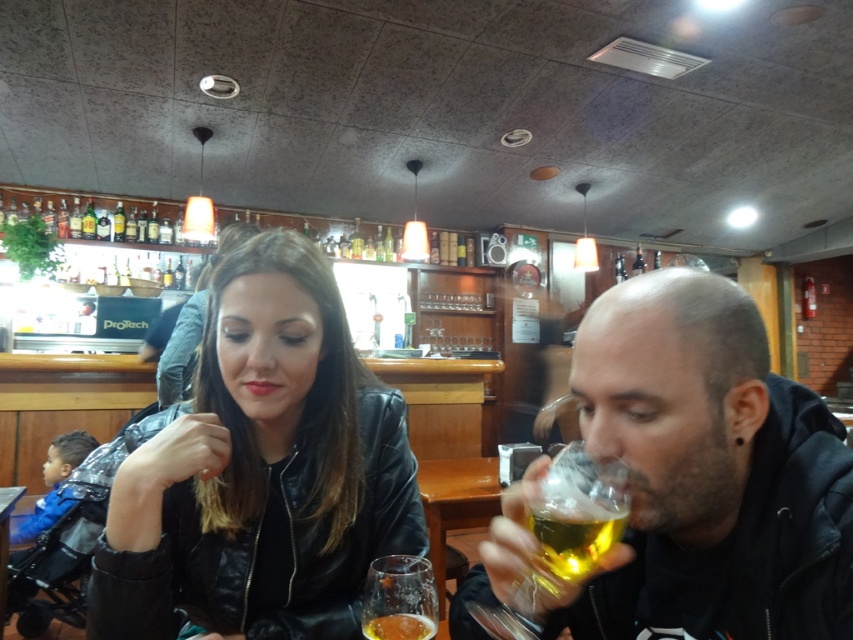
Is the position of black leather jacket at center more distant than that of matte black jacket at right?

Yes, it is behind matte black jacket at right.

Can you confirm if black leather jacket at center is positioned to the right of matte black jacket at right?

In fact, black leather jacket at center is to the left of matte black jacket at right.

The width and height of the screenshot is (853, 640). I want to click on black leather jacket at center, so click(x=260, y=472).

Does matte black jacket at right come behind wooden table at center?

No, matte black jacket at right is closer to the viewer.

Does matte black jacket at right appear under wooden table at center?

No, matte black jacket at right is not below wooden table at center.

Where is `matte black jacket at right`? matte black jacket at right is located at coordinates (706, 474).

Can you confirm if translucent glass beer at right is thinner than translucent glass beer at lower center?

No.

Between point (550, 499) and point (389, 630), which one is positioned behind?

Positioned behind is point (389, 630).

The height and width of the screenshot is (640, 853). Identify the location of translucent glass beer at right. (573, 518).